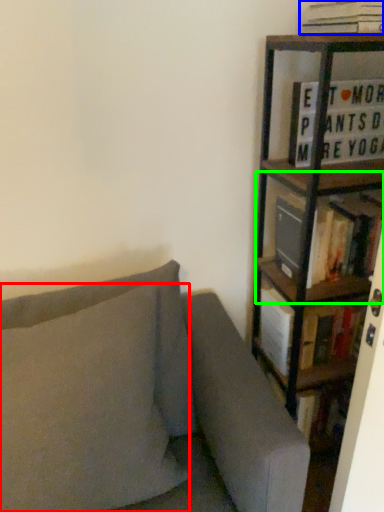
Question: Which object is positioned closest to pillow (highlighted by a red box)? Select from book (highlighted by a blue box) and shelf (highlighted by a green box).

Choices:
 (A) book
 (B) shelf

Answer: (B)